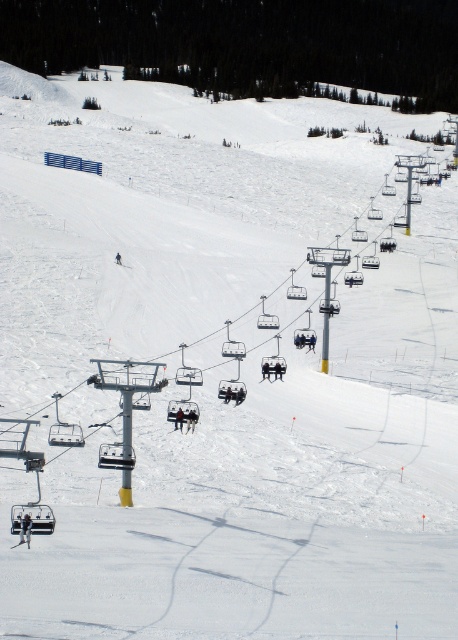
I want to click on dark blue ski suit at center, so click(190, 419).

Locate an element on the screen. The height and width of the screenshot is (640, 458). dark blue ski suit at center is located at coordinates (190, 419).

Can you confirm if matte black skier at lower left is positioned below black plastic skier at center?

Yes, matte black skier at lower left is below black plastic skier at center.

Can you confirm if matte black skier at lower left is positioned to the left of black plastic skier at center?

Yes, matte black skier at lower left is to the left of black plastic skier at center.

Who is more distant from viewer, (21,532) or (176,424)?

The point (176,424) is behind.

Locate an element on the screen. This screenshot has width=458, height=640. matte black skier at lower left is located at coordinates (26, 529).

Who is lower down, dark blue ski suit at center or black fabric skier at center?

Positioned lower is dark blue ski suit at center.

The image size is (458, 640). I want to click on dark blue ski suit at center, so click(190, 419).